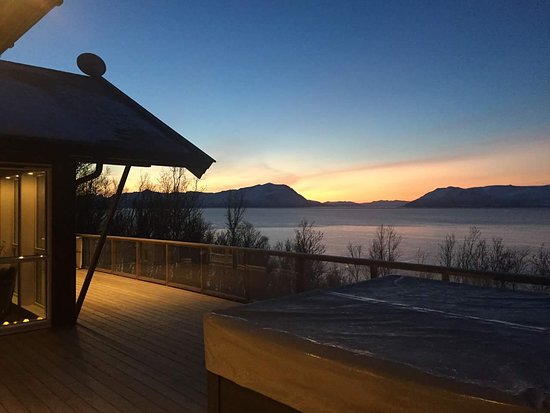
Locate an element on the screen. floor is located at coordinates (182, 287).